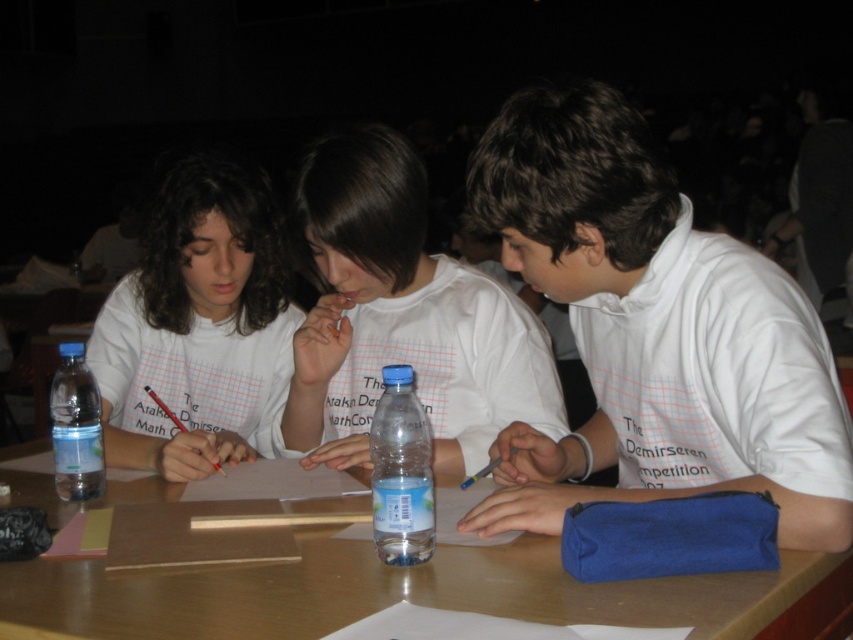
You are organizing a school event and need to choose between the translucent plastic bottle at center and the clear plastic bottle at left for a demonstration. Which bottle is taller?

The translucent plastic bottle at center is taller than the clear plastic bottle at left.

You are standing behind the wooden table at center and want to hand a pencil to the person wearing the matte white shirt at left. In which direction should you move to reach them?

The wooden table at center is to the right of the matte white shirt at left, so you should move to your left to reach the person wearing the matte white shirt at left.